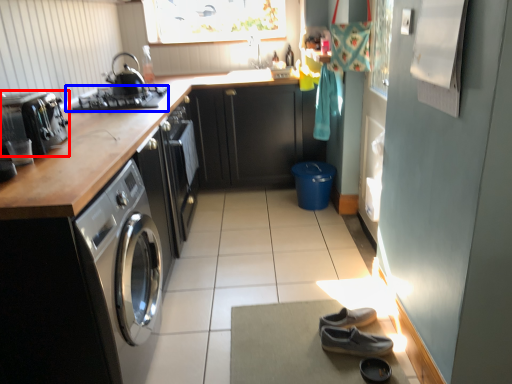
Question: Among these objects, which one is farthest to the camera, home appliance (highlighted by a red box) or gas stove (highlighted by a blue box)?

Choices:
 (A) home appliance
 (B) gas stove

Answer: (B)